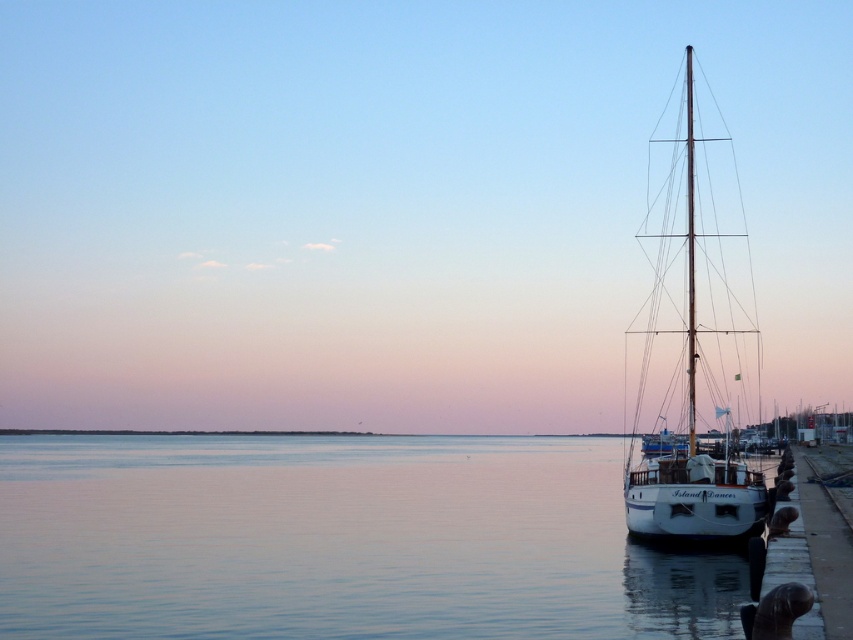
You are standing on the pier and looking out at the water. There are two points marked in the image. Which point, point (137, 588) or point (701, 516), is closer to you?

Point (137, 588) is closer to the viewer than point (701, 516).